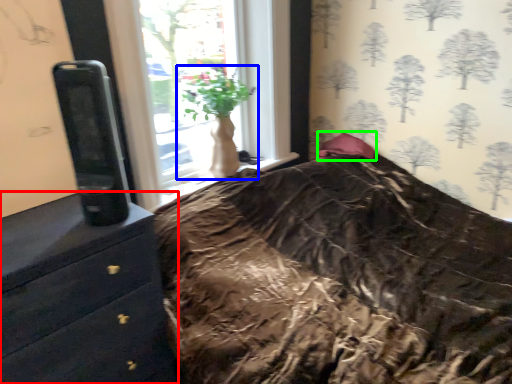
Question: Which is farther away from chest of drawers (highlighted by a red box)? houseplant (highlighted by a blue box) or pillow (highlighted by a green box)?

Choices:
 (A) houseplant
 (B) pillow

Answer: (B)